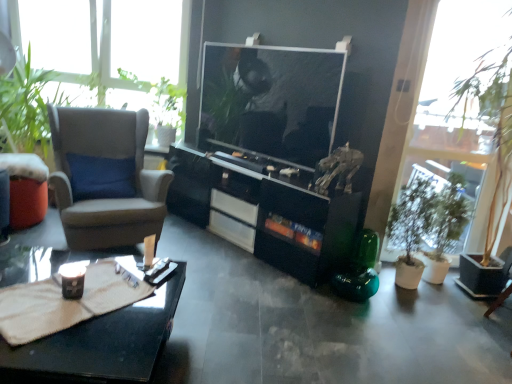
Question: Relative to green leafy plant at right, is gray fabric armchair at left in front or behind?

Choices:
 (A) behind
 (B) front

Answer: (A)

Question: Is gray fabric armchair at left situated inside green leafy plant at right or outside?

Choices:
 (A) outside
 (B) inside

Answer: (A)

Question: Based on their relative distances, which object is farther from the gray fabric armchair at left?

Choices:
 (A) green matte plant at right
 (B) black glossy cabinet at center
 (C) green leafy plant at right
 (D) matte orange table at left
 (E) black glossy coffee table at lower left

Answer: (C)

Question: Considering the real-world distances, which object is farthest from the matte orange table at left?

Choices:
 (A) black glossy cabinet at center
 (B) green matte plant at right
 (C) gray fabric armchair at left
 (D) green leafy plant at right
 (E) black glossy coffee table at lower left

Answer: (D)